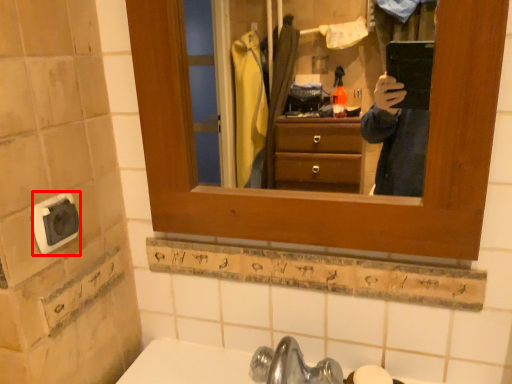
Question: Considering the relative positions of knob (annotated by the red box) and soap in the image provided, where is knob (annotated by the red box) located with respect to the staircase?

Choices:
 (A) right
 (B) left

Answer: (B)